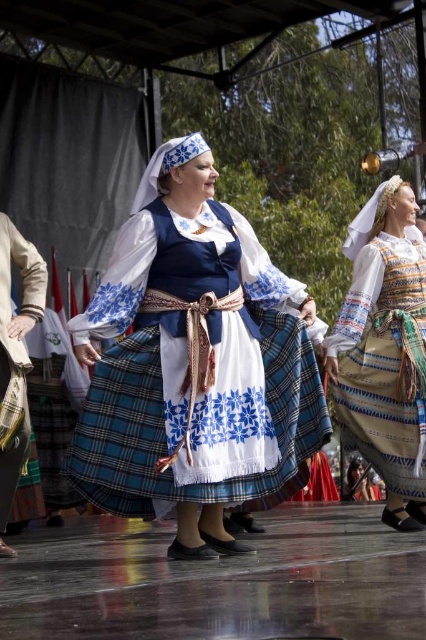
Which is below, embroidered fabric dress at center or plaid fabric skirt at center?

plaid fabric skirt at center

Is embroidered fabric dress at center above plaid fabric skirt at center?

Yes, embroidered fabric dress at center is above plaid fabric skirt at center.

Which is in front, point (357, 280) or point (2, 276)?

Point (2, 276) is in front.

Find the location of a particular element. The height and width of the screenshot is (640, 426). embroidered fabric dress at center is located at coordinates (385, 349).

Can you confirm if blue plaid skirt at center is smaller than embroidered fabric dress at center?

Actually, blue plaid skirt at center might be larger than embroidered fabric dress at center.

Between blue plaid skirt at center and embroidered fabric dress at center, which one appears on the left side from the viewer's perspective?

Positioned to the left is blue plaid skirt at center.

Who is more forward, (123, 314) or (394, 442)?

Positioned in front is point (123, 314).

This screenshot has width=426, height=640. In order to click on blue plaid skirt at center in this screenshot , I will do `click(195, 364)`.

Does blue plaid skirt at center come in front of plaid fabric skirt at center?

That is True.

Who is shorter, blue plaid skirt at center or plaid fabric skirt at center?

Standing shorter between the two is plaid fabric skirt at center.

Where is `blue plaid skirt at center`? blue plaid skirt at center is located at coordinates (195, 364).